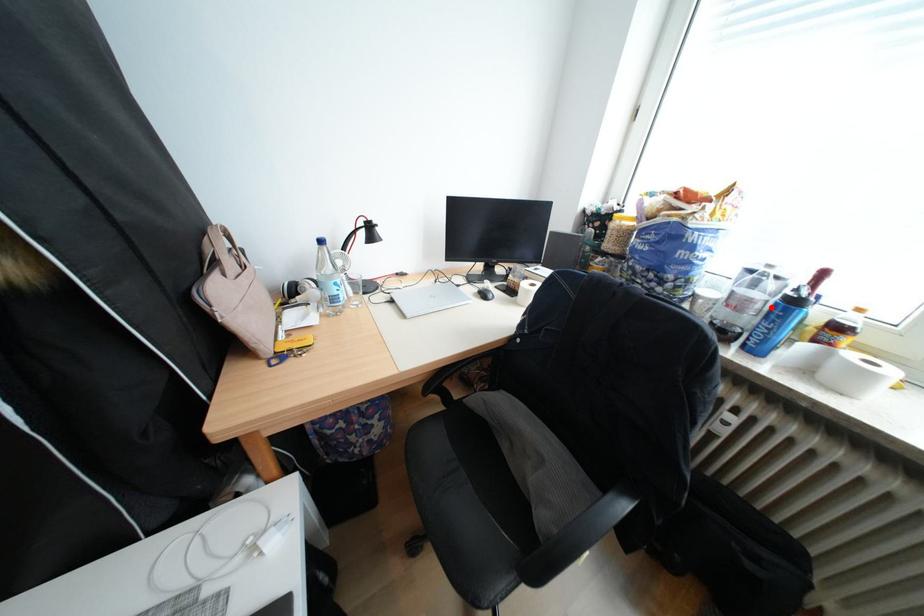
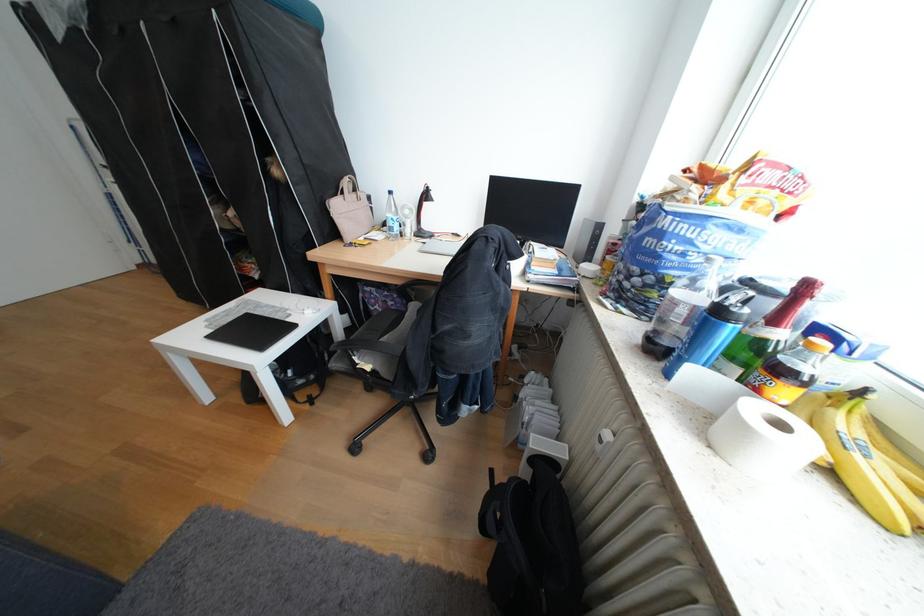
Find the pixel in the second image that matches the highlighted location in the first image.

(695, 312)